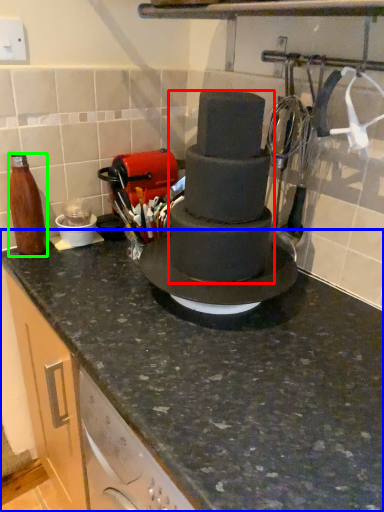
Question: Considering the real-world distances, which object is farthest from chocolate cake (highlighted by a red box)? countertop (highlighted by a blue box) or bottle (highlighted by a green box)?

Choices:
 (A) countertop
 (B) bottle

Answer: (B)